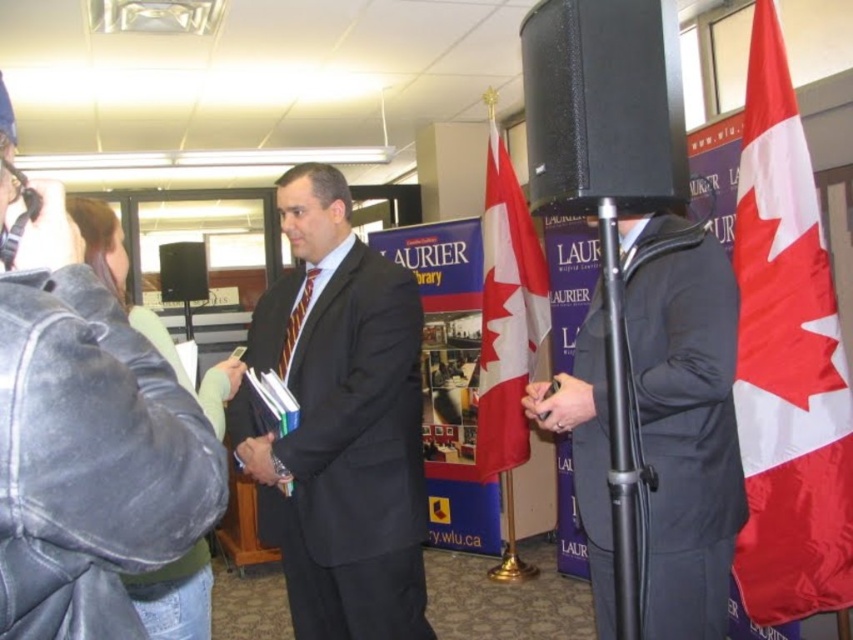
You are organizing a photo shoot and need to place a 1.5m tall prop between the denim jacket at left and the matte black speaker at center. Based on their heights, which object should the prop be placed closer to?

The denim jacket at left is taller than the matte black speaker at center, so the prop should be placed closer to the denim jacket at left to maintain visual balance.

You are organizing a photo shoot and need to position a model wearing a denim jacket at left so that it doesn not block the matte black speaker at center. Based on the scene description, where should you place the model?

The denim jacket at left is located below the matte black speaker at center, so to prevent blocking, the model should be positioned below the matte black speaker at center.